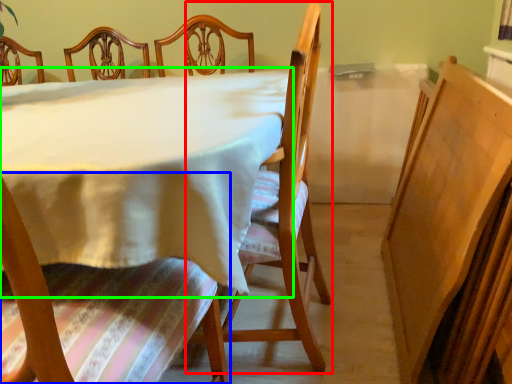
Question: Estimate the real-world distances between objects in this image. Which object is closer to chair (highlighted by a red box), chair (highlighted by a blue box) or table (highlighted by a green box)?

Choices:
 (A) chair
 (B) table

Answer: (B)